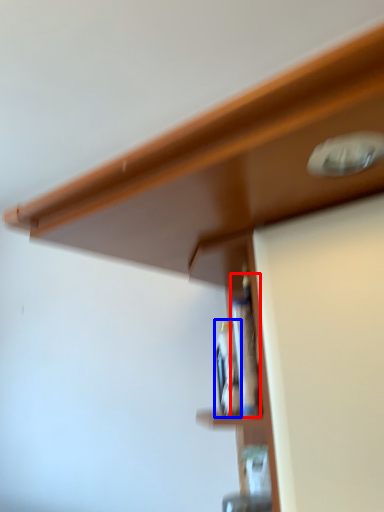
Question: Which of the following is the farthest to the observer, bottle (highlighted by a red box) or bottle (highlighted by a blue box)?

Choices:
 (A) bottle
 (B) bottle

Answer: (B)